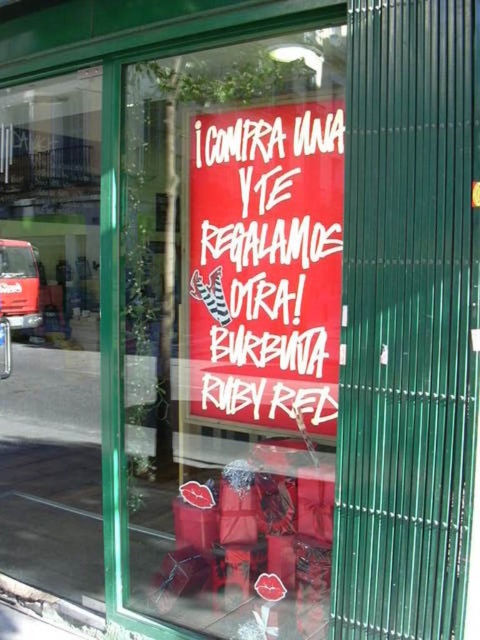
Question: Is red paper sign at center wider than transparent glass window at left?

Choices:
 (A) yes
 (B) no

Answer: (B)

Question: From the image, what is the correct spatial relationship of red paper sign at center in relation to matte red sign at center?

Choices:
 (A) above
 (B) below

Answer: (B)

Question: Estimate the real-world distances between objects in this image. Which object is farther from the transparent glass window at left?

Choices:
 (A) red paper sign at center
 (B) matte red sign at center

Answer: (B)

Question: Which object is farther from the camera taking this photo?

Choices:
 (A) transparent glass window at left
 (B) red paper sign at center

Answer: (A)

Question: Which object is closer to the camera taking this photo?

Choices:
 (A) transparent glass window at left
 (B) matte red sign at center
 (C) red paper sign at center

Answer: (C)

Question: Does transparent glass window at left appear over matte red sign at center?

Choices:
 (A) yes
 (B) no

Answer: (A)